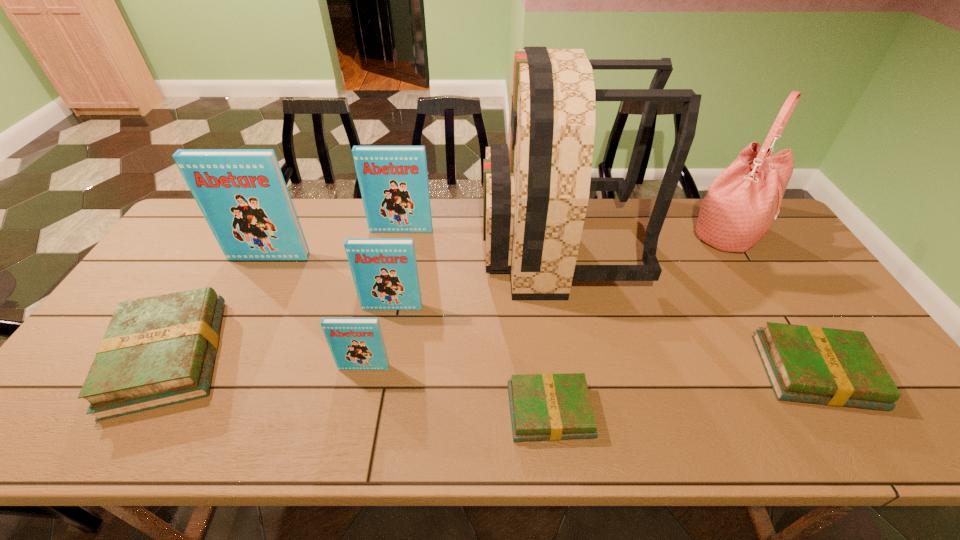
Find the location of a particular element. Image resolution: width=960 pixels, height=540 pixels. the tallest object is located at coordinates (536, 188).

Find the location of `the eighth shortest object`. the eighth shortest object is located at coordinates (742, 202).

I want to click on the leftmost blue book, so tap(242, 194).

The height and width of the screenshot is (540, 960). In order to click on the tallest book in this screenshot , I will do `click(242, 194)`.

At what (x,y) coordinates should I click in order to perform the action: click on the third smallest blue book. Please return your answer as a coordinate pair (x, y). The width and height of the screenshot is (960, 540). Looking at the image, I should click on (393, 180).

Where is `the farthest book`? This screenshot has height=540, width=960. the farthest book is located at coordinates (393, 180).

Locate an element on the screen. This screenshot has height=540, width=960. the second smallest blue book is located at coordinates point(384,270).

Identify the location of the fifth tallest object. The height and width of the screenshot is (540, 960). (384, 270).

Locate an element on the screen. the nearest blue book is located at coordinates (356, 343).

Identify the location of the fourth tallest book. (356, 343).